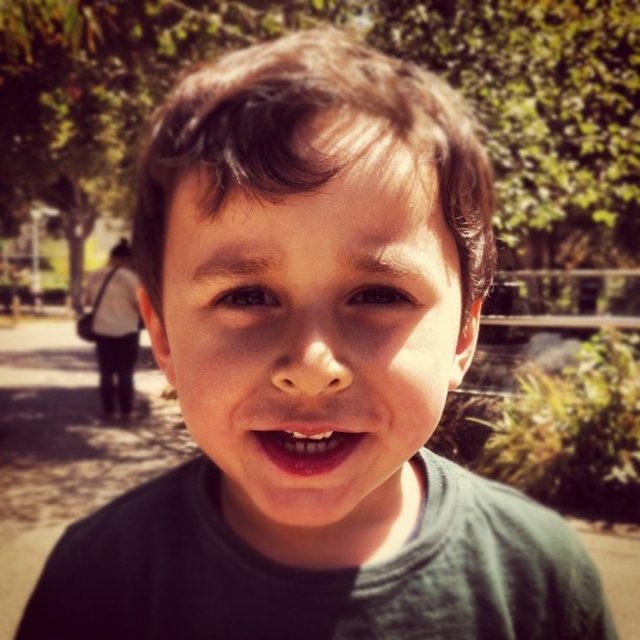
Who is taller, smooth skin face at center or pink glossy lips at center?

Standing taller between the two is smooth skin face at center.

Does point (376, 180) lie behind point (308, 460)?

No, it is not.

Which is in front, point (205, 268) or point (310, 433)?

Point (310, 433) is more forward.

At what (x,y) coordinates should I click in order to perform the action: click on smooth skin face at center. Please return your answer as a coordinate pair (x, y). The width and height of the screenshot is (640, 640). Looking at the image, I should click on (314, 333).